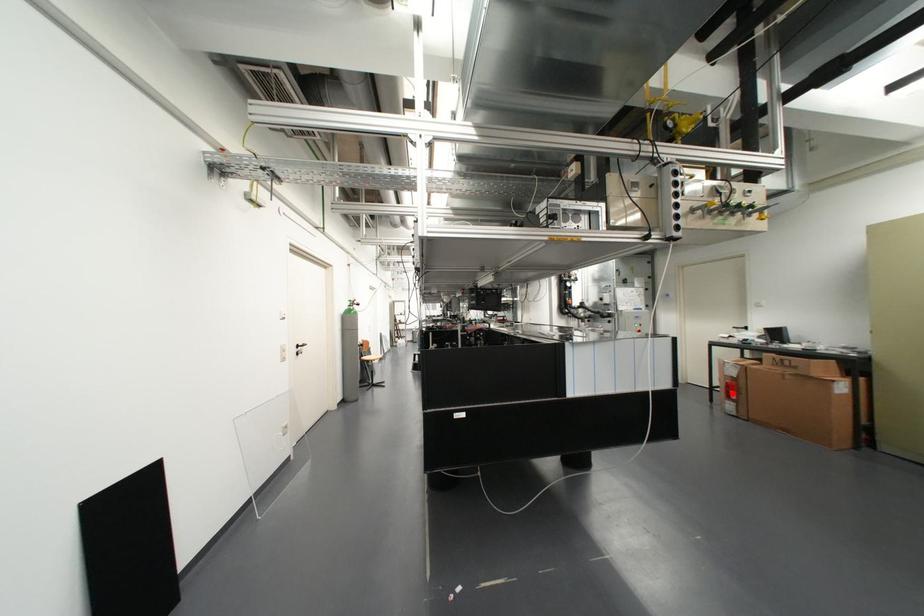
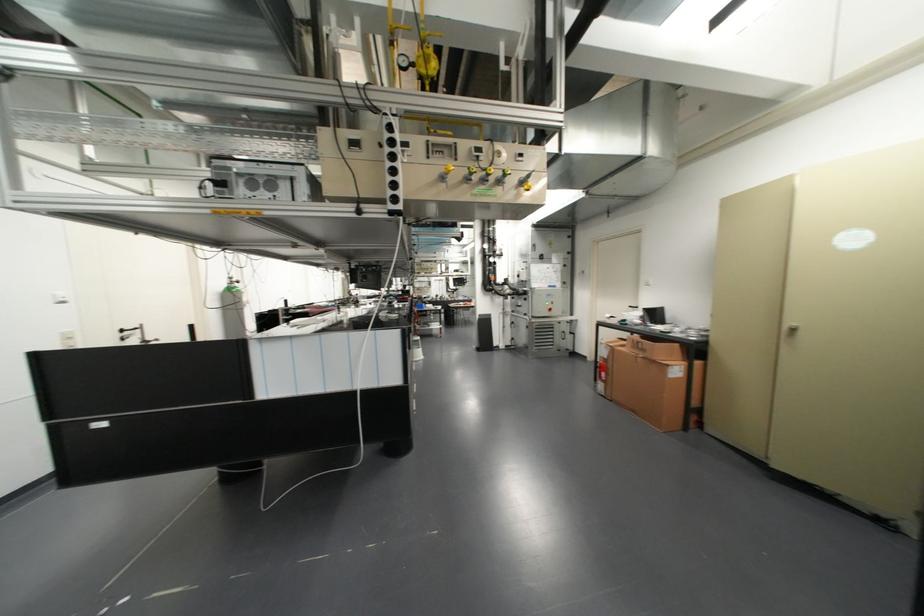
Question: I am providing you with two images of the same scene from different viewpoints. Image1 has a red point marked. In image2, the corresponding 3D location appears at what relative position? Reply with the corresponding letter.

Choices:
 (A) Closer
 (B) Farther

Answer: (A)